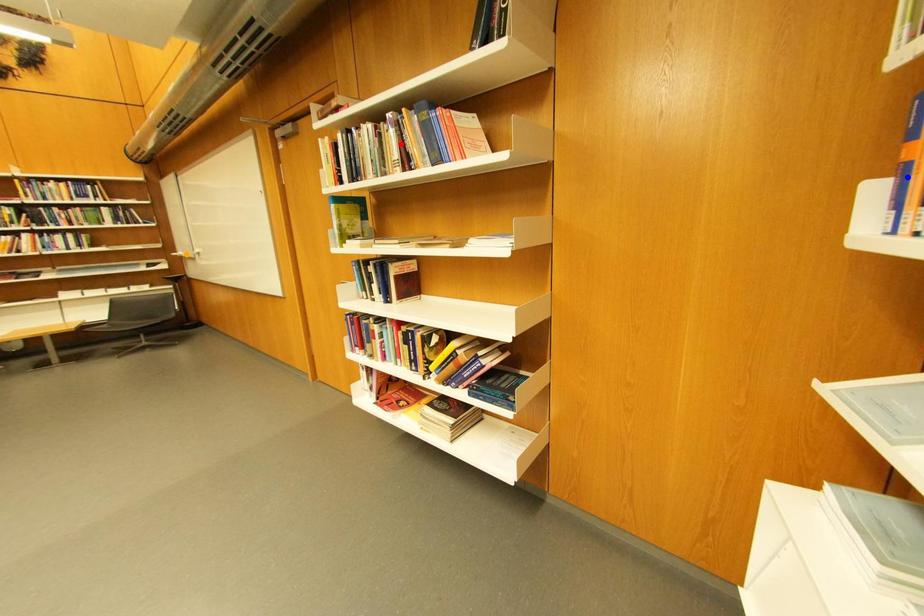
Order these from farthest to nearest:
1. orange point
2. red point
3. blue point

orange point, red point, blue point